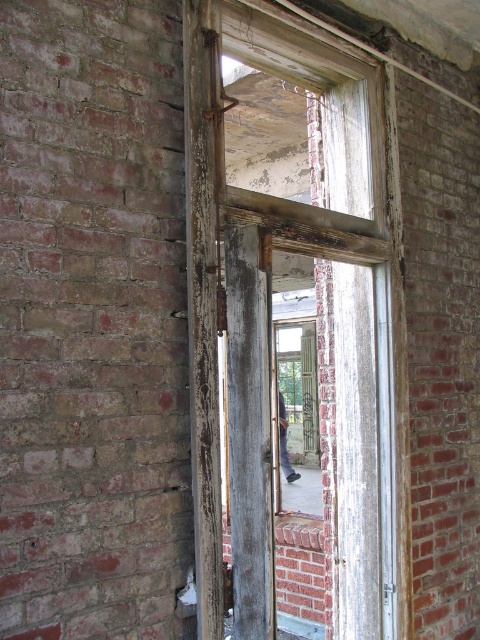
Is weathered wood window frame at center positioned in front of dark gray fabric pants at center?

Yes, it is.

Who is positioned more to the right, weathered wood window frame at center or dark gray fabric pants at center?

From the viewer's perspective, dark gray fabric pants at center appears more on the right side.

Between point (257, 621) and point (286, 470), which one is positioned behind?

The point (286, 470) is behind.

Image resolution: width=480 pixels, height=640 pixels. I want to click on weathered wood window frame at center, so click(x=271, y=336).